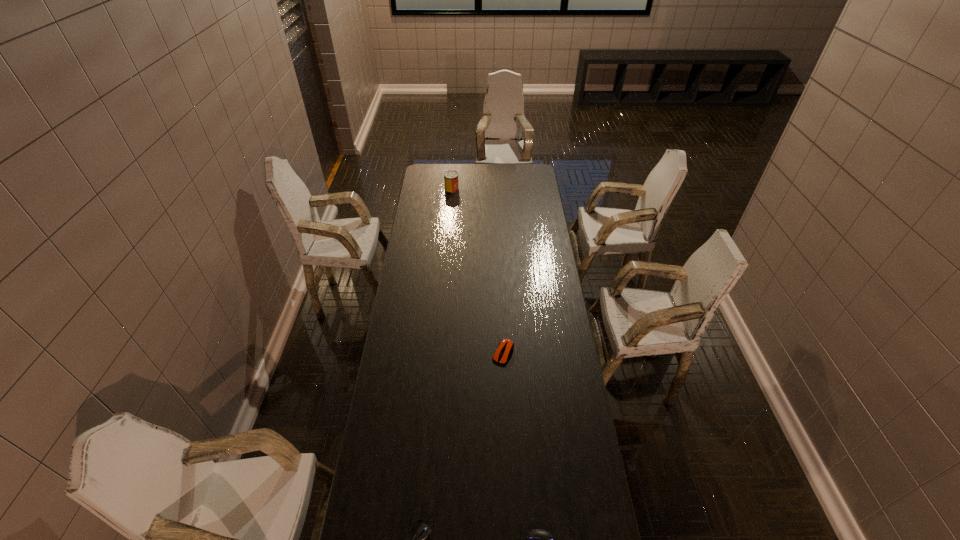
This screenshot has height=540, width=960. In order to click on can in this screenshot , I will do `click(451, 182)`.

This screenshot has height=540, width=960. Identify the location of the tallest object. (451, 182).

In order to click on the farthest computer mouse in this screenshot , I will do `click(505, 347)`.

I want to click on free region located 0.120m on the back of the tallest object, so click(x=453, y=176).

This screenshot has height=540, width=960. Identify the location of free space located 0.160m on the back of the second farthest object. 501,312.

Where is `vacant space at the far edge of the desktop`? Image resolution: width=960 pixels, height=540 pixels. vacant space at the far edge of the desktop is located at coordinates (493, 175).

The height and width of the screenshot is (540, 960). I want to click on vacant position at the left edge of the desktop, so click(420, 297).

Image resolution: width=960 pixels, height=540 pixels. I want to click on free space at the right edge, so click(x=581, y=421).

In the image, there is a desktop. Where is `blank space at the far left corner`? The width and height of the screenshot is (960, 540). blank space at the far left corner is located at coordinates (428, 171).

Locate an element on the screen. Image resolution: width=960 pixels, height=540 pixels. free area in between the farthest computer mouse and the tallest object is located at coordinates coord(478,271).